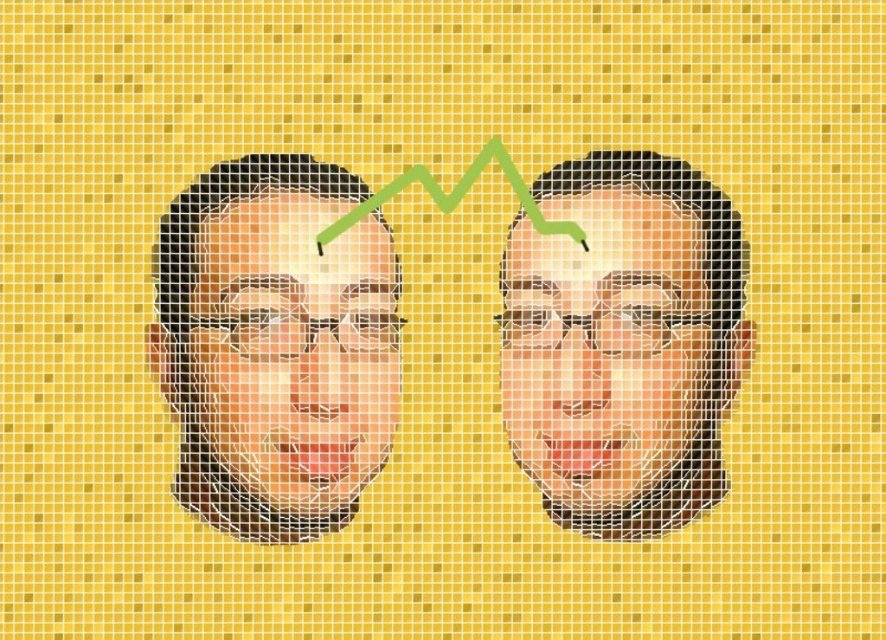
Is the position of smooth skin face at center more distant than that of matte black face at center?

Yes, smooth skin face at center is further from the viewer.

Who is taller, smooth skin face at center or matte black face at center?

matte black face at center is taller.

Where is `smooth skin face at center`? Image resolution: width=886 pixels, height=640 pixels. smooth skin face at center is located at coordinates (604, 346).

Where is `smooth skin face at center`? The image size is (886, 640). smooth skin face at center is located at coordinates (604, 346).